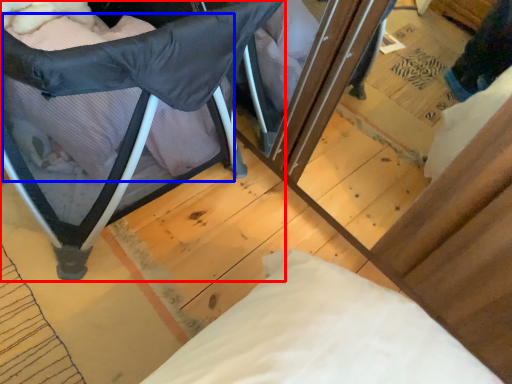
Question: Among these objects, which one is nearest to the camera, furniture (highlighted by a red box) or pillow (highlighted by a blue box)?

Choices:
 (A) furniture
 (B) pillow

Answer: (A)